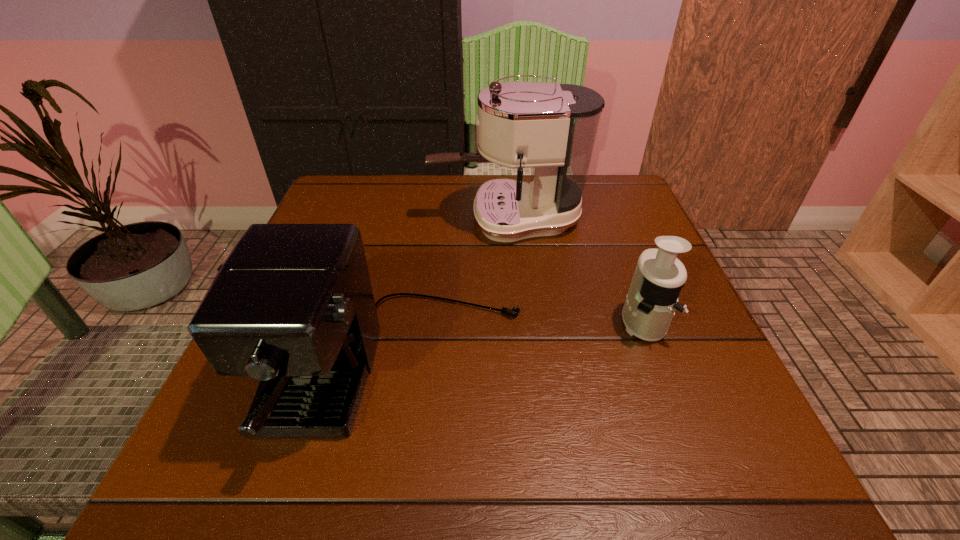
Identify the location of the farther coffee maker. The height and width of the screenshot is (540, 960). (551, 128).

Find the location of `the taller coffee maker`. the taller coffee maker is located at coordinates (551, 128).

Where is `the nearer coffee maker`? The width and height of the screenshot is (960, 540). the nearer coffee maker is located at coordinates (292, 306).

Where is `the second shortest object`? the second shortest object is located at coordinates (292, 306).

Where is `the rightmost object`? This screenshot has width=960, height=540. the rightmost object is located at coordinates (650, 304).

Locate an element on the screen. juicer is located at coordinates (650, 304).

Where is `vacant space located 0.140m on the front-facing side of the farthest object`? vacant space located 0.140m on the front-facing side of the farthest object is located at coordinates (372, 219).

You are a GUI agent. You are given a task and a screenshot of the screen. Output one action in this format:
    pyautogui.click(x=<x>, y=<y>)
    Task: Click on the vacant space located on the front-facing side of the farthest object
    The height and width of the screenshot is (540, 960).
    Given the screenshot: What is the action you would take?
    pyautogui.click(x=409, y=219)

What are the coordinates of `free spot located on the front-facing side of the farthest object` in the screenshot? It's located at (329, 219).

Locate an element on the screen. The height and width of the screenshot is (540, 960). vacant space located on the front of the rightmost object is located at coordinates (676, 409).